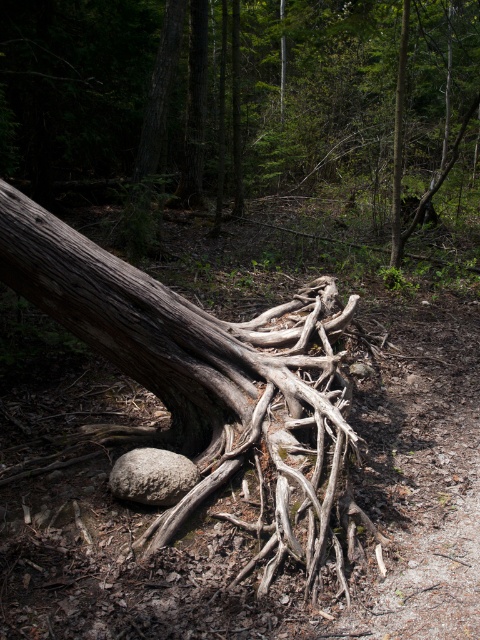
Can you confirm if grayish-brown wood at center is positioned to the right of gray rough boulder at center?

Indeed, grayish-brown wood at center is positioned on the right side of gray rough boulder at center.

Is grayish-brown wood at center above gray rough boulder at center?

Indeed, grayish-brown wood at center is positioned over gray rough boulder at center.

Is point (354, 429) closer to viewer compared to point (132, 461)?

No.

Where is `grayish-brown wood at center`? The width and height of the screenshot is (480, 640). grayish-brown wood at center is located at coordinates (208, 380).

Looking at this image, does drab brown roots at center have a larger size compared to gray rough boulder at center?

Yes, drab brown roots at center is bigger than gray rough boulder at center.

From the picture: Which is below, drab brown roots at center or gray rough boulder at center?

gray rough boulder at center

Measure the distance between point (316, 227) and camera.

Point (316, 227) and camera are 10.46 meters apart.

This screenshot has width=480, height=640. In order to click on drab brown roots at center in this screenshot , I will do `click(247, 113)`.

Who is shorter, drab brown roots at center or grayish-brown wood at center?

Standing shorter between the two is grayish-brown wood at center.

Does drab brown roots at center appear under grayish-brown wood at center?

No, drab brown roots at center is not below grayish-brown wood at center.

Locate an element on the screen. The width and height of the screenshot is (480, 640). drab brown roots at center is located at coordinates (247, 113).